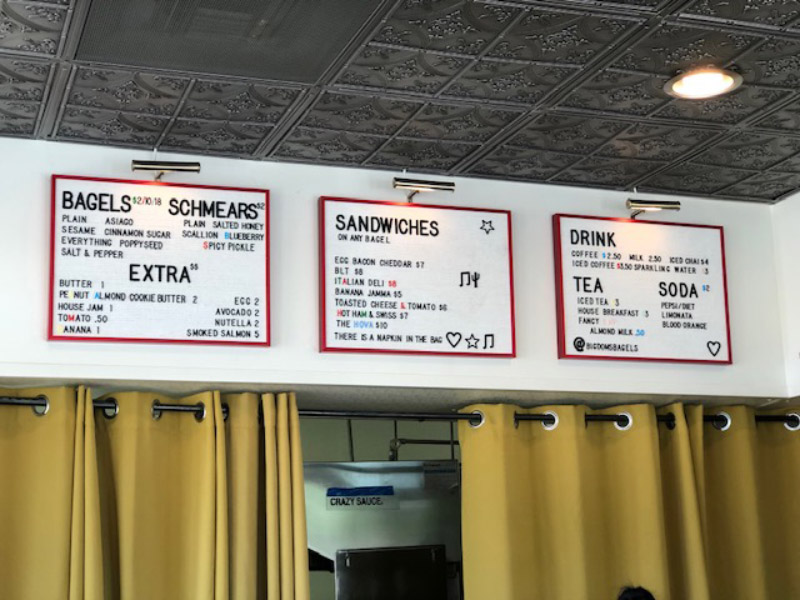
I want to click on curtain rod, so click(18, 397), click(101, 404), click(170, 405), click(222, 407), click(326, 411), click(521, 416), click(601, 416), click(662, 416), click(716, 416), click(760, 417).